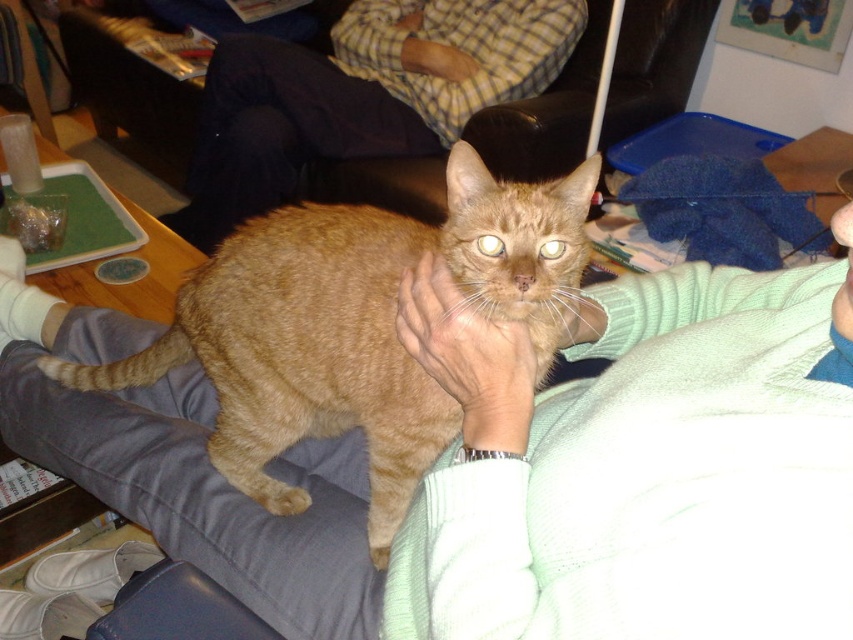
Does orange tabby cat at center come in front of checkered shirt at upper center?

Yes, it is.

Is orange tabby cat at center positioned behind checkered shirt at upper center?

No, it is not.

Between point (212, 372) and point (276, 72), which one is positioned in front?

Positioned in front is point (212, 372).

Where is `orange tabby cat at center`? The width and height of the screenshot is (853, 640). orange tabby cat at center is located at coordinates (355, 326).